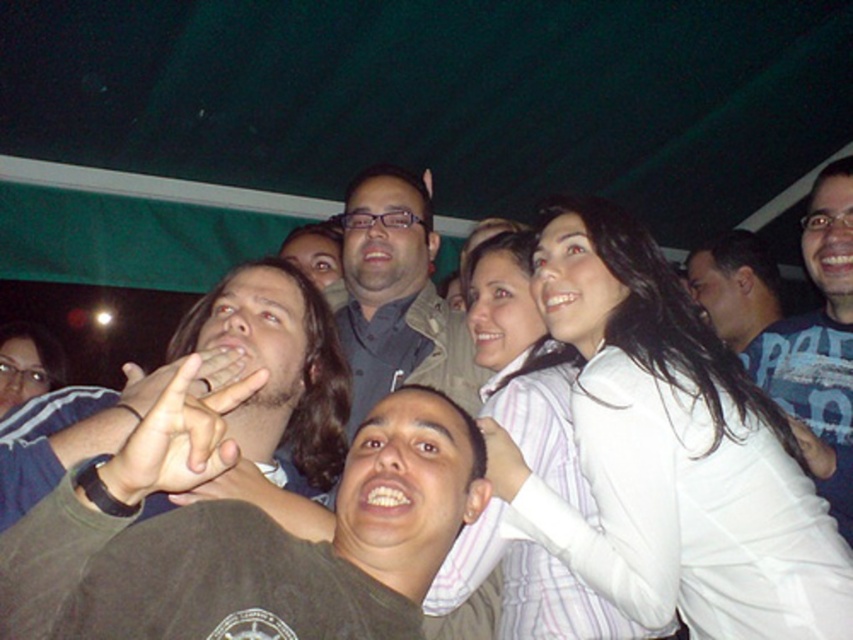
Who is lower down, white striped shirt at upper right or blue shirt at upper right?

Positioned lower is white striped shirt at upper right.

Based on the photo, can you confirm if white striped shirt at upper right is bigger than blue shirt at upper right?

Yes, white striped shirt at upper right is bigger than blue shirt at upper right.

Is point (761, 413) less distant than point (688, 275)?

Yes, it is.

Locate an element on the screen. This screenshot has height=640, width=853. white striped shirt at upper right is located at coordinates (671, 452).

Which of these two, matte gray shirt at center or blue shirt at upper right, stands taller?

matte gray shirt at center is taller.

Between point (424, 212) and point (729, 310), which one is positioned behind?

Positioned behind is point (729, 310).

This screenshot has width=853, height=640. I want to click on matte gray shirt at center, so click(396, 296).

Between matte gray shirt at center and brown leather hand at center, which one is positioned lower?

Positioned lower is brown leather hand at center.

Is matte gray shirt at center in front of brown leather hand at center?

No.

This screenshot has height=640, width=853. In order to click on matte gray shirt at center in this screenshot , I will do `click(396, 296)`.

Locate an element on the screen. matte gray shirt at center is located at coordinates (396, 296).